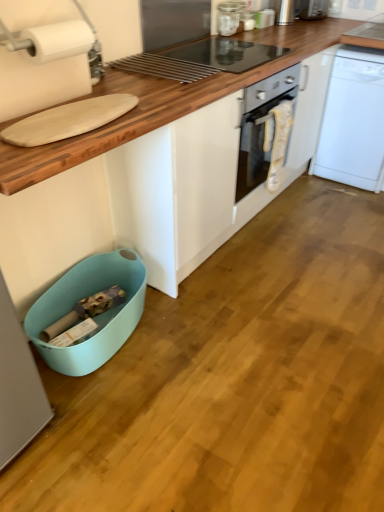
The image size is (384, 512). In order to click on vacant region in front of clear glass jar at upper center, placed as the fourth appliance when sorted from back to front in this screenshot , I will do `click(238, 41)`.